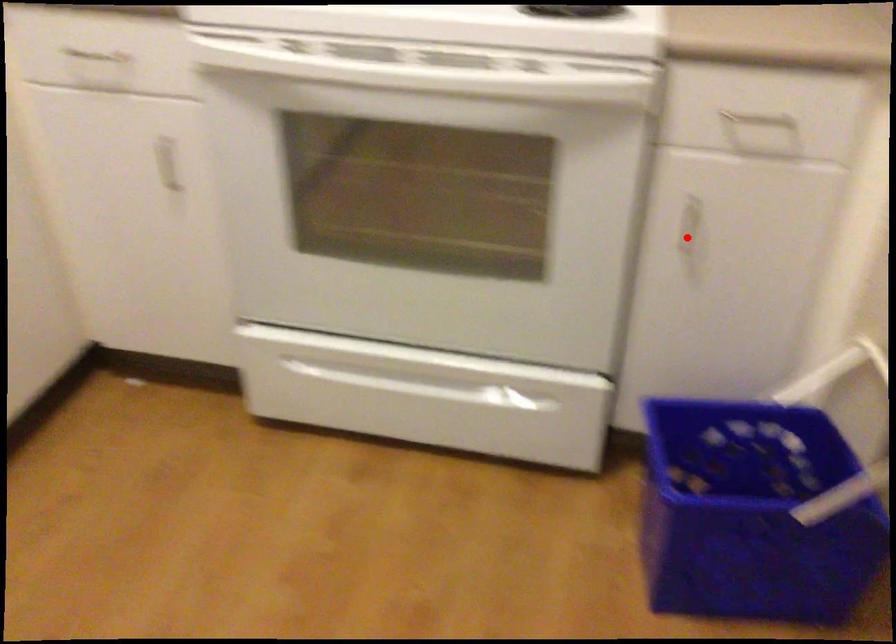
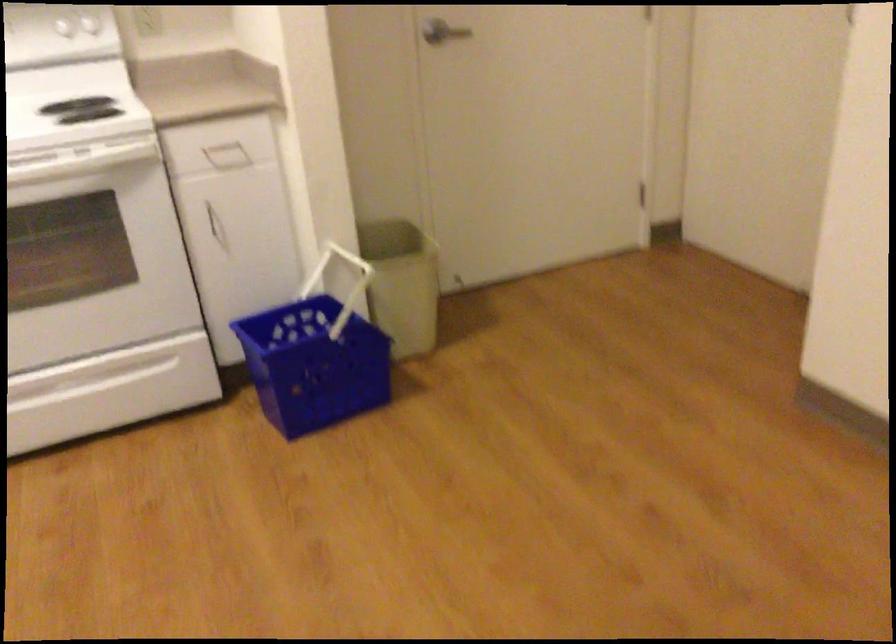
Question: I am providing you with two images of the same scene from different viewpoints. A red point is marked on the first image. Can you still see the location of the red point in image 2?

Choices:
 (A) Yes
 (B) No

Answer: (A)